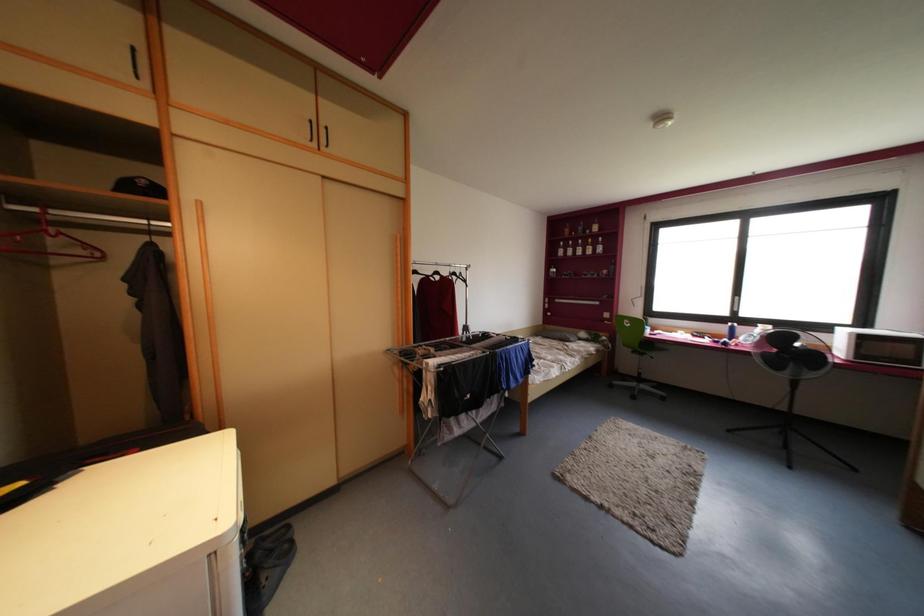
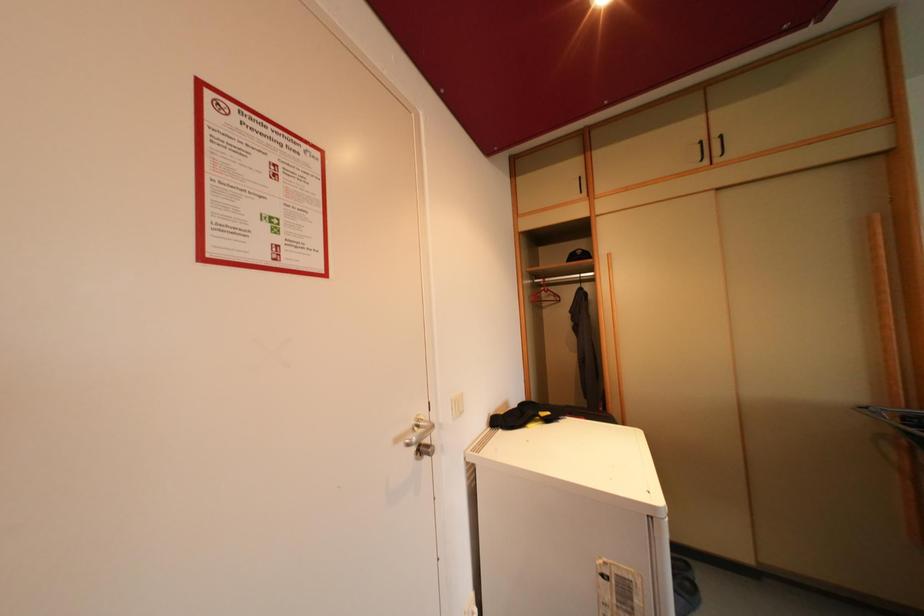
Question: The camera is either moving clockwise (left) or counter-clockwise (right) around the object. The first image is from the beginning of the video and the second image is from the end. Is the camera moving left or right when shooting the video?

Choices:
 (A) Left
 (B) Right

Answer: (B)